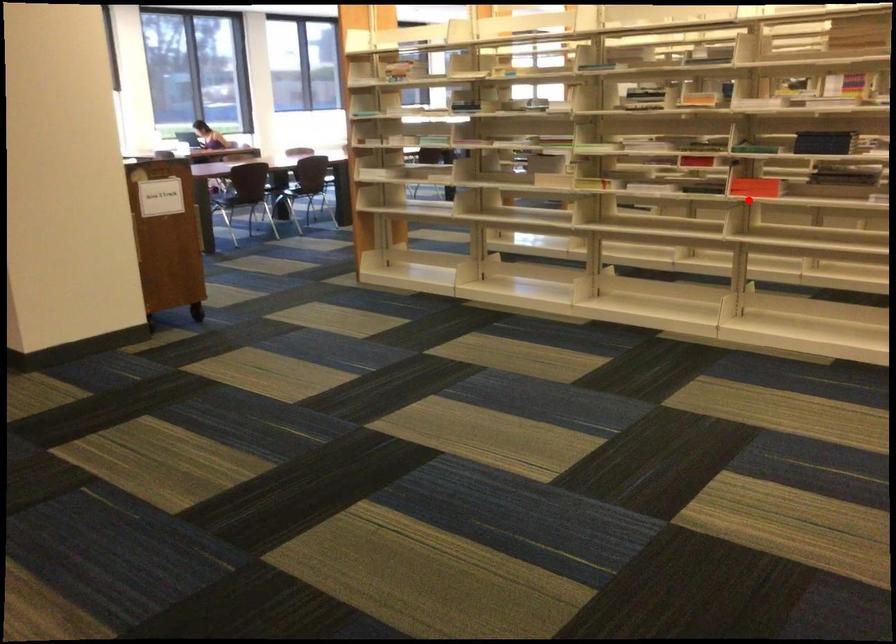
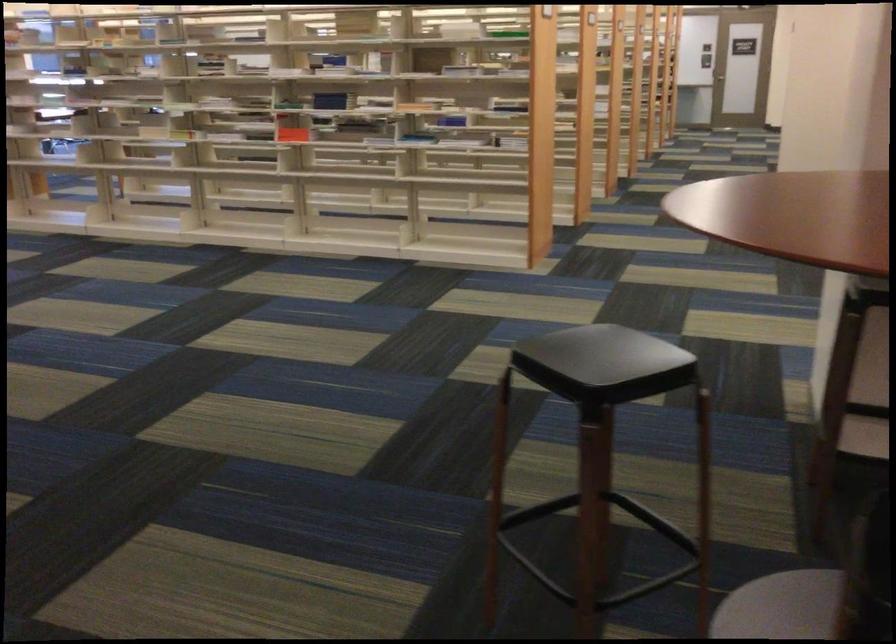
Question: I am providing you with two images of the same scene from different viewpoints. In image1, a red point is highlighted. Considering the same 3D point in image2, which of the following is correct?

Choices:
 (A) It is closer
 (B) It is farther

Answer: (B)